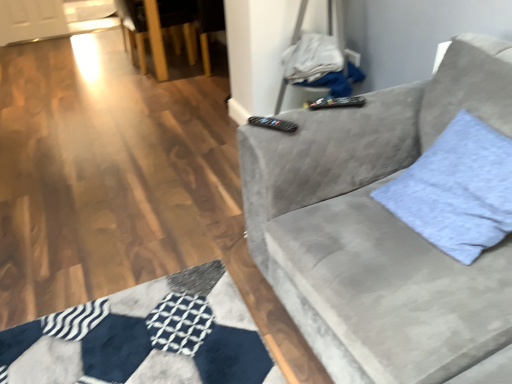
Question: Does black plastic remote at upper center, arranged as the 2th remote when viewed from the top, have a lesser height compared to black plastic remote at upper center, placed as the 1th remote when sorted from right to left?

Choices:
 (A) yes
 (B) no

Answer: (A)

Question: Is black plastic remote at upper center, arranged as the 2th remote when viewed from the top, wider than black plastic remote at upper center, which ranks as the second remote in front-to-back order?

Choices:
 (A) yes
 (B) no

Answer: (B)

Question: Does black plastic remote at upper center, which is the second remote from right to left, have a smaller size compared to black plastic remote at upper center, placed as the 1th remote when sorted from right to left?

Choices:
 (A) no
 (B) yes

Answer: (B)

Question: From a real-world perspective, is black plastic remote at upper center, which is the second remote from right to left, under black plastic remote at upper center, the second remote when ordered from left to right?

Choices:
 (A) no
 (B) yes

Answer: (B)

Question: Is black plastic remote at upper center, the 1th remote viewed from the front, completely or partially outside of black plastic remote at upper center, which appears as the 1th remote when viewed from the back?

Choices:
 (A) yes
 (B) no

Answer: (A)

Question: Is black plastic remote at upper center, which is the 2th remote in back-to-front order, taller or shorter than wooden armchair at upper left?

Choices:
 (A) short
 (B) tall

Answer: (A)

Question: Choose the correct answer: Is black plastic remote at upper center, which appears as the 1th remote when ordered from the bottom, inside wooden armchair at upper left or outside it?

Choices:
 (A) inside
 (B) outside

Answer: (B)

Question: Is point (247, 122) positioned closer to the camera than point (140, 52)?

Choices:
 (A) closer
 (B) farther

Answer: (A)

Question: In terms of width, does black plastic remote at upper center, positioned as the 1th remote in left-to-right order, look wider or thinner when compared to wooden armchair at upper left?

Choices:
 (A) wide
 (B) thin

Answer: (B)

Question: Is point (391, 188) positioned closer to the camera than point (178, 51)?

Choices:
 (A) closer
 (B) farther

Answer: (A)

Question: From a real-world perspective, is light blue fabric pillow at right above or below wooden armchair at upper left?

Choices:
 (A) above
 (B) below

Answer: (A)

Question: Is light blue fabric pillow at right in front of or behind wooden armchair at upper left in the image?

Choices:
 (A) front
 (B) behind

Answer: (A)

Question: From the image's perspective, relative to wooden armchair at upper left, is light blue fabric pillow at right above or below?

Choices:
 (A) above
 (B) below

Answer: (B)

Question: Considering their positions, is light blue fabric pillow at right located in front of or behind velvet gray couch at right?

Choices:
 (A) front
 (B) behind

Answer: (B)

Question: Considering the positions of light blue fabric pillow at right and velvet gray couch at right in the image, is light blue fabric pillow at right wider or thinner than velvet gray couch at right?

Choices:
 (A) thin
 (B) wide

Answer: (A)